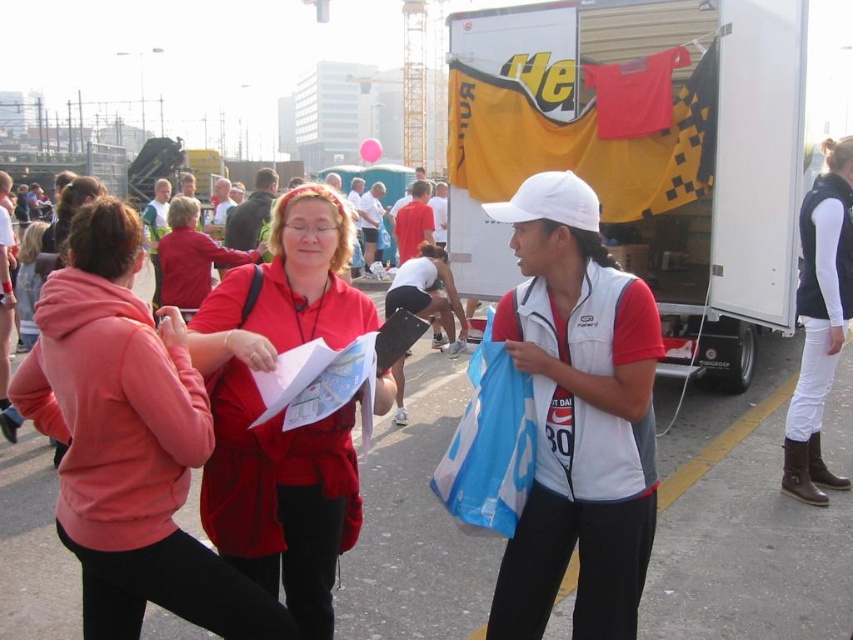
Question: Which point is closer to the camera?

Choices:
 (A) (564, 236)
 (B) (126, 592)

Answer: (B)

Question: Which object is farther from the camera taking this photo?

Choices:
 (A) matte red hoodie at center
 (B) white matte vest at center

Answer: (B)

Question: Is matte red hoodie at center behind white matte vest at center?

Choices:
 (A) no
 (B) yes

Answer: (A)

Question: Among these points, which one is farthest from the camera?

Choices:
 (A) (65, 387)
 (B) (531, 579)
 (C) (363, 320)

Answer: (C)

Question: From the image, what is the correct spatial relationship of matte red hoodie at center in relation to white matte vest at center?

Choices:
 (A) left
 (B) right

Answer: (A)

Question: In this image, where is white matte vest at center located relative to matte red jacket at center?

Choices:
 (A) above
 (B) below

Answer: (A)